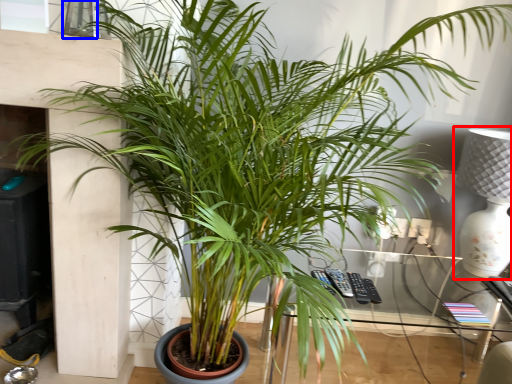
Question: Which object is further to the camera taking this photo, table lamp (highlighted by a red box) or window (highlighted by a blue box)?

Choices:
 (A) table lamp
 (B) window

Answer: (A)